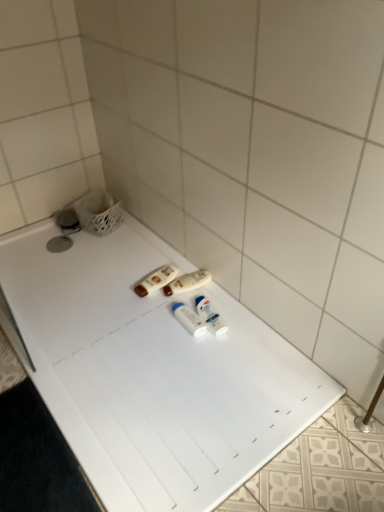
At what (x,y) coordinates should I click in order to perform the action: click on white plastic bottles at center, the second toiletry positioned from the left. Please return your answer as a coordinate pair (x, y). Looking at the image, I should click on (187, 282).

Measure the distance between brown plastic lotion at center, the first toiletry in the left-to-right sequence, and camera.

5.74 feet.

The image size is (384, 512). I want to click on white plastic deodorant at center, acting as the first toiletry starting from the right, so click(x=210, y=316).

What do you see at coordinates (210, 316) in the screenshot?
I see `white plastic deodorant at center, acting as the first toiletry starting from the right` at bounding box center [210, 316].

Find the location of a particular element. white plastic bathtub at center is located at coordinates (153, 372).

What do you see at coordinates (153, 372) in the screenshot? I see `white plastic bathtub at center` at bounding box center [153, 372].

Locate an element on the screen. The height and width of the screenshot is (512, 384). white plastic bottles at center, which is the third toiletry in right-to-left order is located at coordinates (187, 282).

Considering their positions, is brown plastic lotion at center, the first toiletry in the left-to-right sequence, located in front of or behind white plastic bottles at center, acting as the second toiletry starting from the right?

brown plastic lotion at center, the first toiletry in the left-to-right sequence, is positioned farther from the viewer than white plastic bottles at center, acting as the second toiletry starting from the right.

Identify the location of the 3rd toiletry above the white plastic bottles at center, the 3th toiletry when ordered from left to right (from the image's perspective). (155, 280).

Which point is more distant from viewer, (161,269) or (199,324)?

Point (161,269)

From the image's perspective, is brown plastic lotion at center, positioned as the 4th toiletry in right-to-left order, beneath white plastic bottles at center, acting as the second toiletry starting from the right?

No.

Which is nearer, [167,281] or [198,272]?

Positioned in front is point [167,281].

Does brown plastic lotion at center, positioned as the 4th toiletry in right-to-left order, have a lesser width compared to white plastic bottles at center, the second toiletry positioned from the left?

Correct, the width of brown plastic lotion at center, positioned as the 4th toiletry in right-to-left order, is less than that of white plastic bottles at center, the second toiletry positioned from the left.

Can you confirm if brown plastic lotion at center, positioned as the 4th toiletry in right-to-left order, is shorter than white plastic bottles at center, the second toiletry positioned from the left?

Yes.

From a real-world perspective, is brown plastic lotion at center, the first toiletry in the left-to-right sequence, located beneath white plastic bottles at center, the second toiletry positioned from the left?

Yes.

You are a GUI agent. You are given a task and a screenshot of the screen. Output one action in this format:
    pyautogui.click(x=<x>, y=<y>)
    Task: Click on the toiletry above the white plastic bottles at center, the second toiletry positioned from the left (from the image's perspective)
    The width and height of the screenshot is (384, 512).
    Given the screenshot: What is the action you would take?
    pyautogui.click(x=155, y=280)

Between point (190, 273) and point (158, 277), which one is positioned behind?

The point (190, 273) is farther from the camera.

Is white plastic bottles at center, which is the third toiletry in right-to-left order, wider than brown plastic lotion at center, the first toiletry in the left-to-right sequence?

Yes, white plastic bottles at center, which is the third toiletry in right-to-left order, is wider than brown plastic lotion at center, the first toiletry in the left-to-right sequence.

Does white plastic bottles at center, which is the third toiletry in right-to-left order, have a smaller size compared to brown plastic lotion at center, the first toiletry in the left-to-right sequence?

Actually, white plastic bottles at center, which is the third toiletry in right-to-left order, might be larger than brown plastic lotion at center, the first toiletry in the left-to-right sequence.

Is point (108, 479) farther from camera compared to point (146, 285)?

That is False.

From the image's perspective, which is above, white plastic bathtub at center or brown plastic lotion at center, positioned as the 4th toiletry in right-to-left order?

From the image's view, brown plastic lotion at center, positioned as the 4th toiletry in right-to-left order, is above.

Would you say white plastic bathtub at center is inside or outside brown plastic lotion at center, positioned as the 4th toiletry in right-to-left order?

white plastic bathtub at center is not enclosed by brown plastic lotion at center, positioned as the 4th toiletry in right-to-left order.

Considering the sizes of objects white plastic bathtub at center and brown plastic lotion at center, positioned as the 4th toiletry in right-to-left order, in the image provided, who is wider, white plastic bathtub at center or brown plastic lotion at center, positioned as the 4th toiletry in right-to-left order,?

white plastic bathtub at center.

From the image's perspective, would you say brown plastic lotion at center, the first toiletry in the left-to-right sequence, is positioned over white plastic bathtub at center?

Yes, from the image's perspective, brown plastic lotion at center, the first toiletry in the left-to-right sequence, is on top of white plastic bathtub at center.

Which point is more distant from viewer, (147, 275) or (70, 403)?

The point (147, 275) is more distant.

Between brown plastic lotion at center, the first toiletry in the left-to-right sequence, and white plastic bathtub at center, which one is positioned in front?

white plastic bathtub at center is in front.

Consider the image. Can you confirm if brown plastic lotion at center, positioned as the 4th toiletry in right-to-left order, is taller than white plastic bathtub at center?

Yes.

Is white plastic bottles at center, which is the third toiletry in right-to-left order, next to white plastic bottles at center, the 3th toiletry when ordered from left to right?

No, white plastic bottles at center, which is the third toiletry in right-to-left order, is not with white plastic bottles at center, the 3th toiletry when ordered from left to right.

Could you tell me if white plastic bottles at center, the second toiletry positioned from the left, is turned towards white plastic bottles at center, acting as the second toiletry starting from the right?

No, white plastic bottles at center, the second toiletry positioned from the left, is not turned towards white plastic bottles at center, acting as the second toiletry starting from the right.

Can we say white plastic bottles at center, the second toiletry positioned from the left, lies outside white plastic bottles at center, the 3th toiletry when ordered from left to right?

Yes, white plastic bottles at center, the second toiletry positioned from the left, is located beyond the bounds of white plastic bottles at center, the 3th toiletry when ordered from left to right.

Are white plastic bottles at center, the 3th toiletry when ordered from left to right, and white plastic bottles at center, the second toiletry positioned from the left, far apart?

white plastic bottles at center, the 3th toiletry when ordered from left to right, is near white plastic bottles at center, the second toiletry positioned from the left, not far away.

Who is more distant, white plastic bottles at center, acting as the second toiletry starting from the right, or white plastic bottles at center, which is the third toiletry in right-to-left order?

white plastic bottles at center, which is the third toiletry in right-to-left order.

Between white plastic bottles at center, acting as the second toiletry starting from the right, and white plastic bottles at center, the second toiletry positioned from the left, which one has more height?

Standing taller between the two is white plastic bottles at center, the second toiletry positioned from the left.

Is white plastic bottles at center, acting as the second toiletry starting from the right, oriented away from white plastic bottles at center, which is the third toiletry in right-to-left order?

white plastic bottles at center, acting as the second toiletry starting from the right, does not have its back to white plastic bottles at center, which is the third toiletry in right-to-left order.

From the white plastic bottles at center, acting as the second toiletry starting from the right, count 3rd toiletrys backward and point to it. Please provide its 2D coordinates.

[(155, 280)]

Locate an element on the screen. toiletry that is the 1st object to the right of the brown plastic lotion at center, the first toiletry in the left-to-right sequence, starting at the anchor is located at coordinates pyautogui.click(x=187, y=282).

In the scene shown: Estimate the real-world distances between objects in this image. Which object is further from white plastic deodorant at center, marked as the fourth toiletry in a left-to-right arrangement, white plastic bottles at center, the second toiletry positioned from the left, or brown plastic lotion at center, positioned as the 4th toiletry in right-to-left order?

brown plastic lotion at center, positioned as the 4th toiletry in right-to-left order, lies further to white plastic deodorant at center, marked as the fourth toiletry in a left-to-right arrangement, than the other object.

Estimate the real-world distances between objects in this image. Which object is further from brown plastic lotion at center, positioned as the 4th toiletry in right-to-left order, white plastic bathtub at center or white plastic bottles at center, the 3th toiletry when ordered from left to right?

white plastic bathtub at center is further to brown plastic lotion at center, positioned as the 4th toiletry in right-to-left order.

Considering their positions, is brown plastic lotion at center, positioned as the 4th toiletry in right-to-left order, positioned further to white plastic bathtub at center than white plastic deodorant at center, acting as the first toiletry starting from the right?

brown plastic lotion at center, positioned as the 4th toiletry in right-to-left order.

Considering their positions, is brown plastic lotion at center, positioned as the 4th toiletry in right-to-left order, positioned further to white plastic bottles at center, the 3th toiletry when ordered from left to right, than white plastic bottles at center, which is the third toiletry in right-to-left order?

Based on the image, brown plastic lotion at center, positioned as the 4th toiletry in right-to-left order, appears to be further to white plastic bottles at center, the 3th toiletry when ordered from left to right.

Estimate the real-world distances between objects in this image. Which object is closer to white plastic deodorant at center, acting as the first toiletry starting from the right, brown plastic lotion at center, positioned as the 4th toiletry in right-to-left order, or white plastic bottles at center, acting as the second toiletry starting from the right?

white plastic bottles at center, acting as the second toiletry starting from the right, is positioned closer to the anchor white plastic deodorant at center, acting as the first toiletry starting from the right.

Considering their positions, is brown plastic lotion at center, positioned as the 4th toiletry in right-to-left order, positioned further to white plastic bathtub at center than white plastic bottles at center, the 3th toiletry when ordered from left to right?

A: brown plastic lotion at center, positioned as the 4th toiletry in right-to-left order, is positioned further to the anchor white plastic bathtub at center.

Considering their positions, is brown plastic lotion at center, positioned as the 4th toiletry in right-to-left order, positioned further to white plastic bottles at center, the second toiletry positioned from the left, than white plastic deodorant at center, acting as the first toiletry starting from the right?

white plastic deodorant at center, acting as the first toiletry starting from the right.

From the image, which object appears to be farther from white plastic bathtub at center, white plastic deodorant at center, marked as the fourth toiletry in a left-to-right arrangement, or brown plastic lotion at center, the first toiletry in the left-to-right sequence?

brown plastic lotion at center, the first toiletry in the left-to-right sequence, lies further to white plastic bathtub at center than the other object.

You are a GUI agent. You are given a task and a screenshot of the screen. Output one action in this format:
    pyautogui.click(x=<x>, y=<y>)
    Task: Click on the toiletry positioned between white plastic bathtub at center and white plastic deodorant at center, acting as the first toiletry starting from the right, from near to far
    The width and height of the screenshot is (384, 512).
    Given the screenshot: What is the action you would take?
    pyautogui.click(x=188, y=319)

Where is `toiletry between white plastic bottles at center, acting as the second toiletry starting from the right, and white plastic bottles at center, the second toiletry positioned from the left, in the front-back direction`? The image size is (384, 512). toiletry between white plastic bottles at center, acting as the second toiletry starting from the right, and white plastic bottles at center, the second toiletry positioned from the left, in the front-back direction is located at coordinates (210, 316).